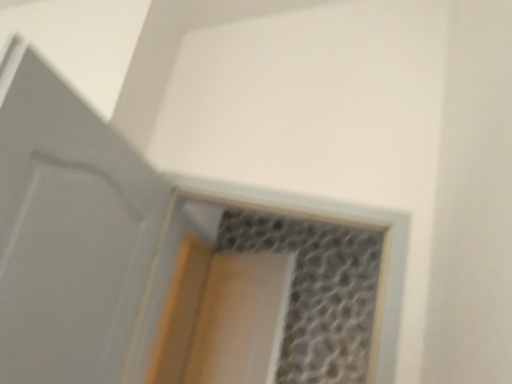
Question: From a real-world perspective, is translucent glass window at center below clear plastic screen door at center?

Choices:
 (A) no
 (B) yes

Answer: (A)

Question: Is translucent glass window at center completely or partially outside of clear plastic screen door at center?

Choices:
 (A) no
 (B) yes

Answer: (B)

Question: Does translucent glass window at center have a greater width compared to clear plastic screen door at center?

Choices:
 (A) yes
 (B) no

Answer: (A)

Question: Does translucent glass window at center have a smaller size compared to clear plastic screen door at center?

Choices:
 (A) no
 (B) yes

Answer: (A)

Question: From the image's perspective, is translucent glass window at center under clear plastic screen door at center?

Choices:
 (A) no
 (B) yes

Answer: (A)

Question: Considering the relative sizes of translucent glass window at center and clear plastic screen door at center in the image provided, is translucent glass window at center bigger than clear plastic screen door at center?

Choices:
 (A) no
 (B) yes

Answer: (B)

Question: Is the position of white matte door at left more distant than that of clear plastic screen door at center?

Choices:
 (A) no
 (B) yes

Answer: (A)

Question: Is white matte door at left touching clear plastic screen door at center?

Choices:
 (A) no
 (B) yes

Answer: (A)

Question: Is clear plastic screen door at center at the back of white matte door at left?

Choices:
 (A) yes
 (B) no

Answer: (B)

Question: Is white matte door at left outside of clear plastic screen door at center?

Choices:
 (A) no
 (B) yes

Answer: (B)

Question: Can you confirm if white matte door at left is thinner than clear plastic screen door at center?

Choices:
 (A) no
 (B) yes

Answer: (A)

Question: From the image's perspective, does white matte door at left appear higher than clear plastic screen door at center?

Choices:
 (A) yes
 (B) no

Answer: (A)

Question: Can you confirm if translucent glass window at center is shorter than white matte door at left?

Choices:
 (A) no
 (B) yes

Answer: (A)